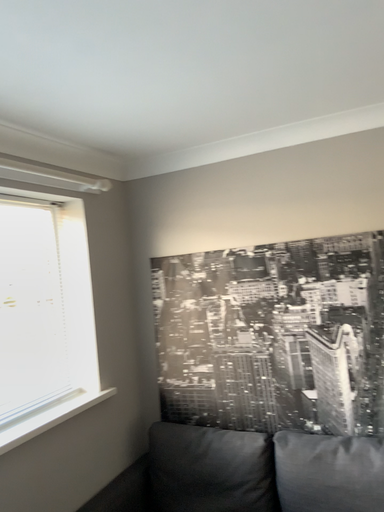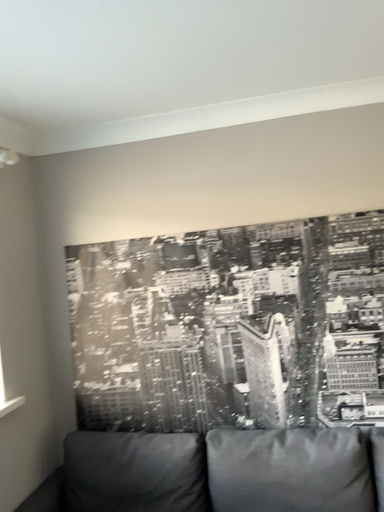
Question: Which way did the camera rotate in the video?

Choices:
 (A) rotated right
 (B) rotated left

Answer: (A)